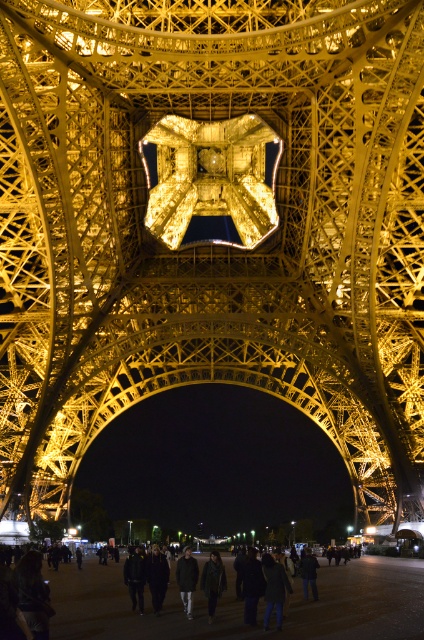
Question: Can you confirm if dark gray leather jacket at center is positioned to the left of dark gray fabric jacket at center?

Choices:
 (A) yes
 (B) no

Answer: (B)

Question: Does dark gray leather jacket at center appear on the right side of dark gray fabric jacket at center?

Choices:
 (A) no
 (B) yes

Answer: (B)

Question: Estimate the real-world distances between objects in this image. Which object is closer to the dark gray coat at lower center?

Choices:
 (A) dark gray fabric jacket at center
 (B) dark gray leather jacket at center

Answer: (A)

Question: Is dark gray leather jacket at center further to the viewer compared to dark gray fabric jacket at center?

Choices:
 (A) yes
 (B) no

Answer: (B)

Question: Among these objects, which one is nearest to the camera?

Choices:
 (A) dark gray leather jacket at center
 (B) dark gray fabric jacket at center
 (C) dark gray coat at lower center

Answer: (C)

Question: Which object appears closest to the camera in this image?

Choices:
 (A) dark gray fabric jacket at center
 (B) dark gray leather jacket at center
 (C) dark gray coat at lower center

Answer: (C)